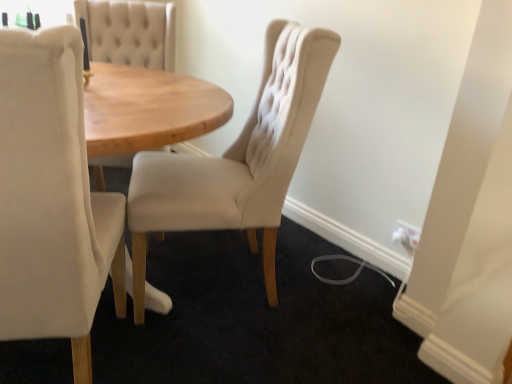
Question: Does beige fabric chair at left, which is the 1th chair in left-to-right order, have a lesser height compared to white plastic electric outlet at lower right?

Choices:
 (A) no
 (B) yes

Answer: (A)

Question: From a real-world perspective, is beige fabric chair at left, which is the 1th chair in left-to-right order, on white plastic electric outlet at lower right?

Choices:
 (A) no
 (B) yes

Answer: (B)

Question: Is beige fabric chair at left, placed as the second chair when sorted from right to left, touching white plastic electric outlet at lower right?

Choices:
 (A) yes
 (B) no

Answer: (B)

Question: Is beige fabric chair at left, placed as the second chair when sorted from right to left, wider than white plastic electric outlet at lower right?

Choices:
 (A) yes
 (B) no

Answer: (A)

Question: Is beige fabric chair at left, placed as the second chair when sorted from right to left, further to camera compared to white plastic electric outlet at lower right?

Choices:
 (A) no
 (B) yes

Answer: (A)

Question: Is white plastic electric outlet at lower right taller or shorter than beige fabric chair at center, which is the second chair from left to right?

Choices:
 (A) short
 (B) tall

Answer: (A)

Question: Based on their positions, is white plastic electric outlet at lower right located to the left or right of beige fabric chair at center, which is the 1th chair in right-to-left order?

Choices:
 (A) left
 (B) right

Answer: (B)

Question: Considering the positions of point tap(398, 231) and point tap(327, 71), is point tap(398, 231) closer or farther from the camera than point tap(327, 71)?

Choices:
 (A) closer
 (B) farther

Answer: (B)

Question: Considering the positions of white plastic electric outlet at lower right and beige fabric chair at center, which is the 1th chair in right-to-left order, in the image, is white plastic electric outlet at lower right bigger or smaller than beige fabric chair at center, which is the 1th chair in right-to-left order,?

Choices:
 (A) big
 (B) small

Answer: (B)

Question: In terms of width, does beige fabric chair at center, which is the second chair from left to right, look wider or thinner when compared to beige fabric chair at left, which is the 1th chair in left-to-right order?

Choices:
 (A) thin
 (B) wide

Answer: (A)

Question: In the image, is beige fabric chair at center, which is the 1th chair in right-to-left order, positioned in front of or behind beige fabric chair at left, which is the 1th chair in left-to-right order?

Choices:
 (A) front
 (B) behind

Answer: (B)

Question: In the image, is beige fabric chair at center, which is the second chair from left to right, on the left side or the right side of beige fabric chair at left, placed as the second chair when sorted from right to left?

Choices:
 (A) right
 (B) left

Answer: (A)

Question: From a real-world perspective, is beige fabric chair at center, which is the 1th chair in right-to-left order, positioned above or below beige fabric chair at left, which is the 1th chair in left-to-right order?

Choices:
 (A) below
 (B) above

Answer: (A)

Question: Considering the relative positions of beige fabric chair at center, which is the 1th chair in right-to-left order, and white plastic electric outlet at lower right in the image provided, is beige fabric chair at center, which is the 1th chair in right-to-left order, to the left or to the right of white plastic electric outlet at lower right?

Choices:
 (A) right
 (B) left

Answer: (B)

Question: Is beige fabric chair at center, which is the 1th chair in right-to-left order, taller or shorter than white plastic electric outlet at lower right?

Choices:
 (A) short
 (B) tall

Answer: (B)